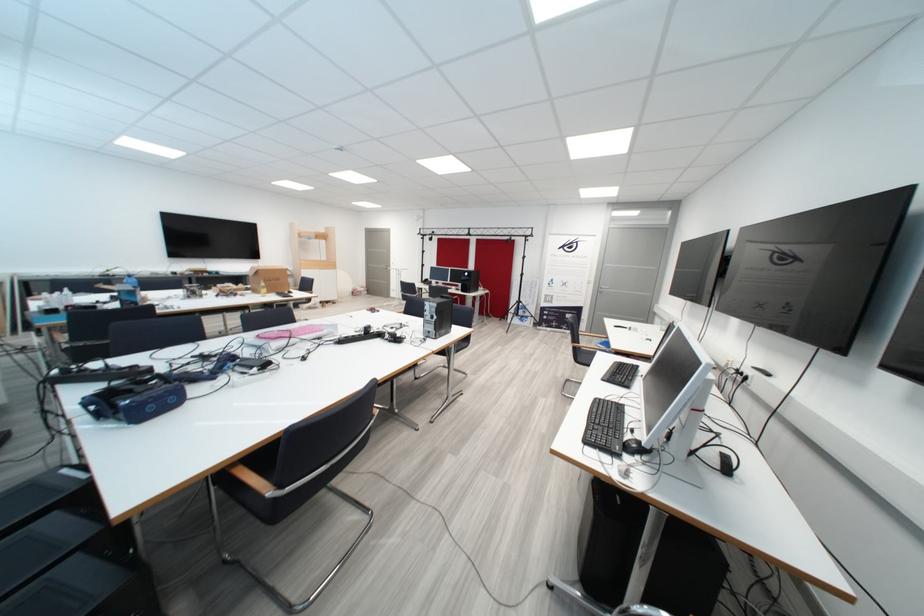
At what (x,y) coordinates should I click in order to perform the action: click on gray door handle. Please return your answer as a coordinate pair (x, y). Looking at the image, I should click on (602, 286).